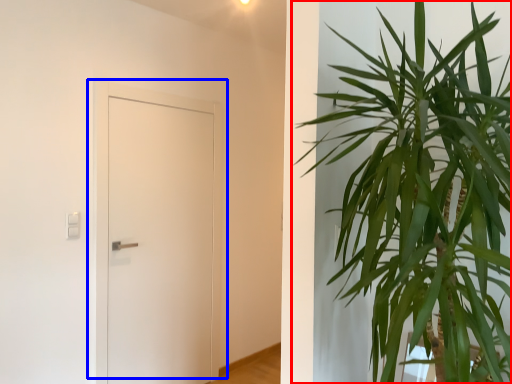
Question: Which object is further to the camera taking this photo, houseplant (highlighted by a red box) or door (highlighted by a blue box)?

Choices:
 (A) houseplant
 (B) door

Answer: (B)